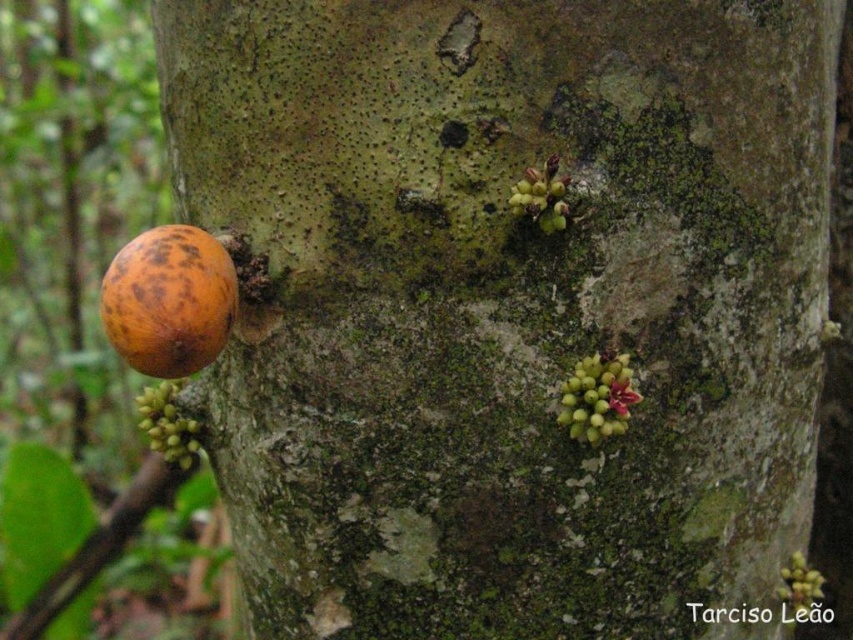
You are a botanist examining the tree trunk. You need to determine which object is bigger between the rotten orange fruit at left and the green matte cluster at upper center. Based on the scene, which one is larger?

The rotten orange fruit at left is larger in size than the green matte cluster at upper center.

You are an animal foraging for food in the forest. You see the rotten orange fruit at left and the green matte cluster at upper center. Which one is located below the other?

The rotten orange fruit at left is positioned under the green matte cluster at upper center.